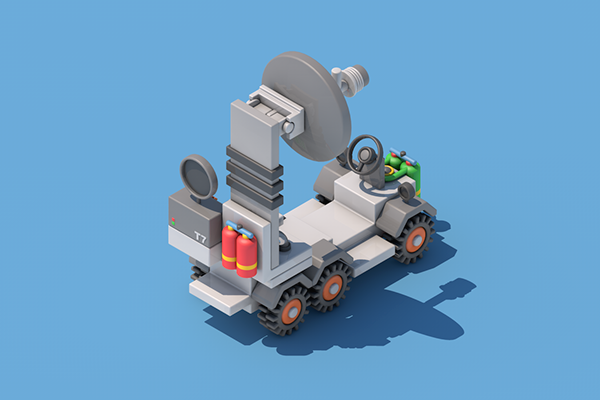
At what (x,y) coordinates should I click in order to perform the action: click on large round dish. Please return your answer as a coordinate pair (x, y). The image size is (600, 400). Looking at the image, I should click on (326, 115).